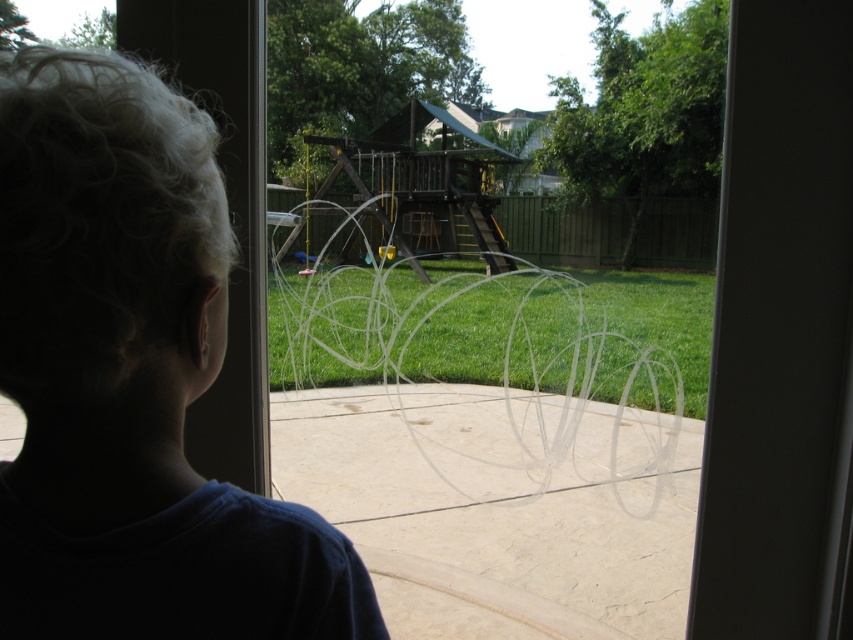
Question: Which point appears closest to the camera in this image?

Choices:
 (A) (396, 340)
 (B) (125, 253)
 (C) (763, 458)

Answer: (B)

Question: Does dark blue shirt at left appear on the left side of green grass at center?

Choices:
 (A) no
 (B) yes

Answer: (B)

Question: Which point appears closest to the camera in this image?

Choices:
 (A) (757, 474)
 (B) (326, 353)

Answer: (A)

Question: Is dark blue shirt at left to the right of transparent plastic screen door at center from the viewer's perspective?

Choices:
 (A) yes
 (B) no

Answer: (B)

Question: Is transparent plastic screen door at center positioned before green grass at center?

Choices:
 (A) yes
 (B) no

Answer: (A)

Question: Which point is farther to the camera?

Choices:
 (A) dark blue shirt at left
 (B) transparent plastic screen door at center

Answer: (B)